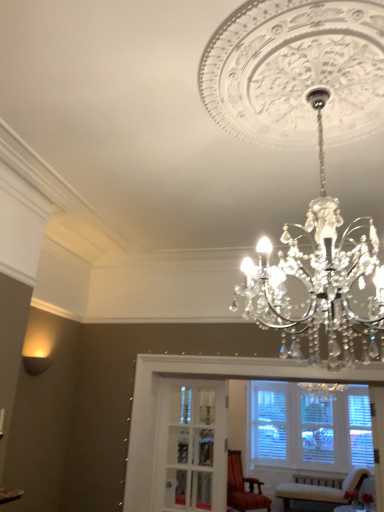
Question: In which direction should I rotate to look at wooden armchair at center, arranged as the 2th chair when viewed from the right?

Choices:
 (A) left
 (B) right

Answer: (B)

Question: Is velvet beige chair at lower right, the 2th chair when ordered from left to right, taller than clear glass door at center?

Choices:
 (A) yes
 (B) no

Answer: (B)

Question: Is velvet beige chair at lower right, the 2th chair when ordered from left to right, beside clear glass door at center?

Choices:
 (A) no
 (B) yes

Answer: (A)

Question: Is velvet beige chair at lower right, the 2th chair when ordered from left to right, in front of clear glass door at center?

Choices:
 (A) yes
 (B) no

Answer: (B)

Question: Is velvet beige chair at lower right, the 2th chair when ordered from left to right, outside clear glass door at center?

Choices:
 (A) no
 (B) yes

Answer: (B)

Question: Does velvet beige chair at lower right, the 1th chair from the right, have a lesser height compared to clear glass door at center?

Choices:
 (A) no
 (B) yes

Answer: (B)

Question: Considering the relative sizes of velvet beige chair at lower right, the 1th chair from the right, and clear glass door at center in the image provided, is velvet beige chair at lower right, the 1th chair from the right, smaller than clear glass door at center?

Choices:
 (A) no
 (B) yes

Answer: (A)

Question: From the image's perspective, would you say matte black wall sconce at lower left is positioned over velvet beige chair at lower right, the 2th chair when ordered from left to right?

Choices:
 (A) no
 (B) yes

Answer: (B)

Question: Is matte black wall sconce at lower left at the right side of velvet beige chair at lower right, the 2th chair when ordered from left to right?

Choices:
 (A) yes
 (B) no

Answer: (B)

Question: Is matte black wall sconce at lower left oriented away from velvet beige chair at lower right, the 2th chair when ordered from left to right?

Choices:
 (A) yes
 (B) no

Answer: (B)

Question: Would you say matte black wall sconce at lower left is outside velvet beige chair at lower right, the 1th chair from the right?

Choices:
 (A) no
 (B) yes

Answer: (B)

Question: From the image's perspective, is matte black wall sconce at lower left under velvet beige chair at lower right, the 2th chair when ordered from left to right?

Choices:
 (A) yes
 (B) no

Answer: (B)

Question: Is matte black wall sconce at lower left smaller than velvet beige chair at lower right, the 1th chair from the right?

Choices:
 (A) yes
 (B) no

Answer: (A)

Question: Is matte black wall sconce at lower left smaller than wooden armchair at center, arranged as the 2th chair when viewed from the right?

Choices:
 (A) yes
 (B) no

Answer: (A)